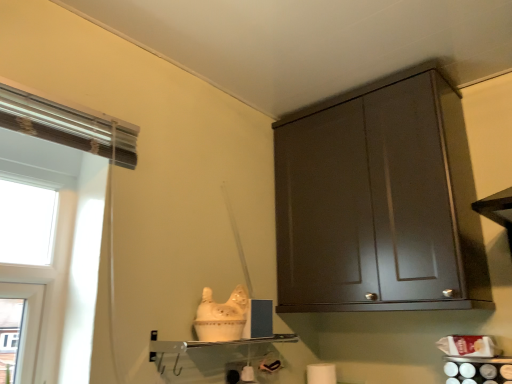
Question: Should I look upward or downward to see clear glass shelf at center?

Choices:
 (A) up
 (B) down

Answer: (B)

Question: Is white matte toilet paper at lower center next to clear glass shelf at center?

Choices:
 (A) no
 (B) yes

Answer: (A)

Question: Does white matte toilet paper at lower center come in front of clear glass shelf at center?

Choices:
 (A) yes
 (B) no

Answer: (B)

Question: Can you confirm if white matte toilet paper at lower center is taller than clear glass shelf at center?

Choices:
 (A) yes
 (B) no

Answer: (A)

Question: From a real-world perspective, is white matte toilet paper at lower center physically above clear glass shelf at center?

Choices:
 (A) no
 (B) yes

Answer: (A)

Question: Is clear glass shelf at center surrounded by white matte toilet paper at lower center?

Choices:
 (A) yes
 (B) no

Answer: (B)

Question: From the image's perspective, is white matte toilet paper at lower center located beneath clear glass shelf at center?

Choices:
 (A) no
 (B) yes

Answer: (B)

Question: Is clear glass shelf at center beside white matte toilet paper at lower center?

Choices:
 (A) yes
 (B) no

Answer: (B)

Question: Does clear glass shelf at center turn towards white matte toilet paper at lower center?

Choices:
 (A) no
 (B) yes

Answer: (A)

Question: Can you confirm if clear glass shelf at center is bigger than white matte toilet paper at lower center?

Choices:
 (A) yes
 (B) no

Answer: (A)

Question: Is clear glass shelf at center looking in the opposite direction of white matte toilet paper at lower center?

Choices:
 (A) no
 (B) yes

Answer: (A)

Question: Is there a large distance between clear glass shelf at center and white matte toilet paper at lower center?

Choices:
 (A) no
 (B) yes

Answer: (A)

Question: Considering the relative positions of clear glass shelf at center and white matte toilet paper at lower center in the image provided, is clear glass shelf at center to the left of white matte toilet paper at lower center from the viewer's perspective?

Choices:
 (A) no
 (B) yes

Answer: (B)

Question: Is white matte toilet paper at lower center at the right side of dark wood cabinet at upper right?

Choices:
 (A) yes
 (B) no

Answer: (B)